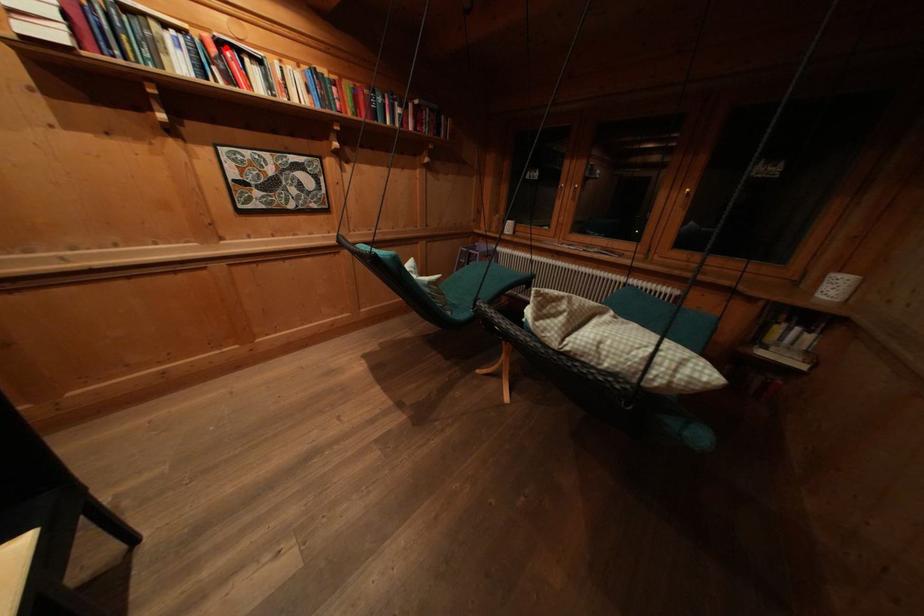
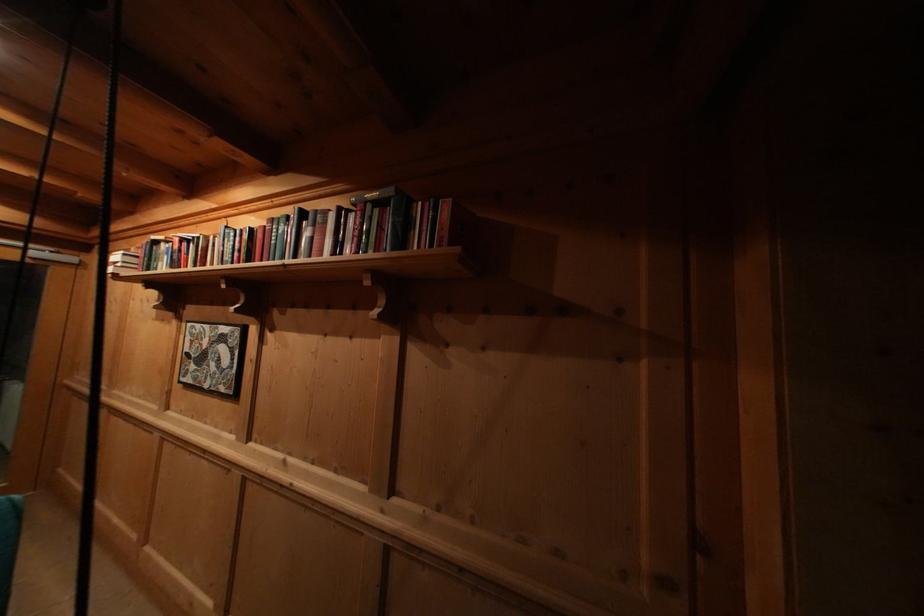
In the second image, find the point that corresponds to the highlighted location in the first image.

(188, 246)